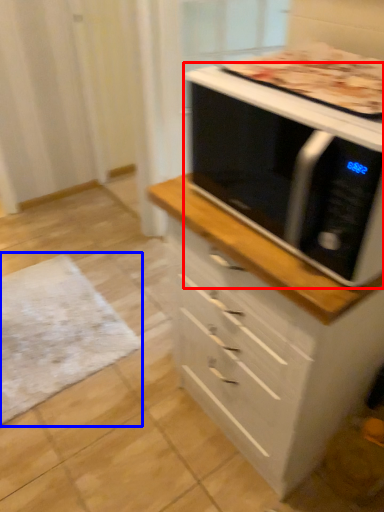
Question: Which point is further to the camera, microwave oven (highlighted by a red box) or mat (highlighted by a blue box)?

Choices:
 (A) microwave oven
 (B) mat

Answer: (B)